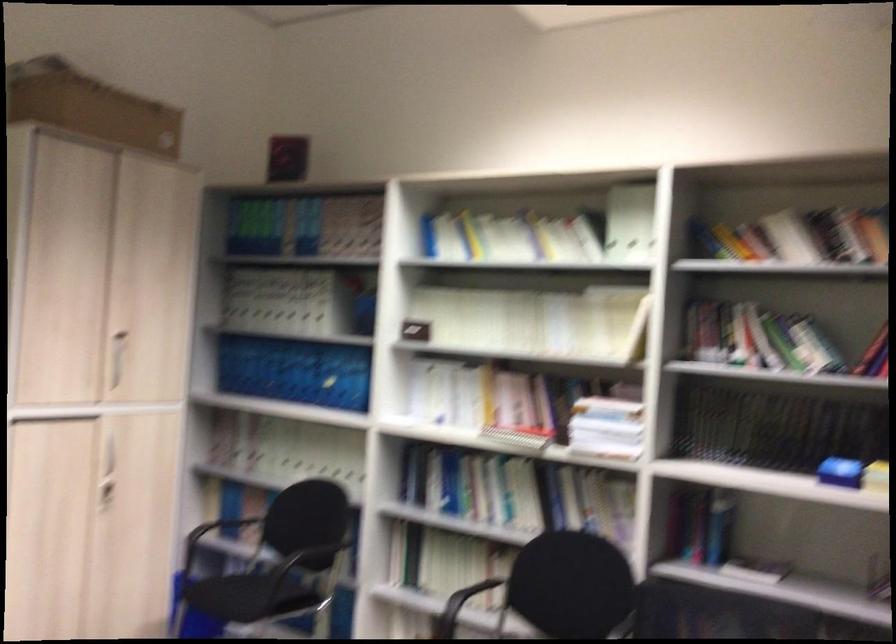
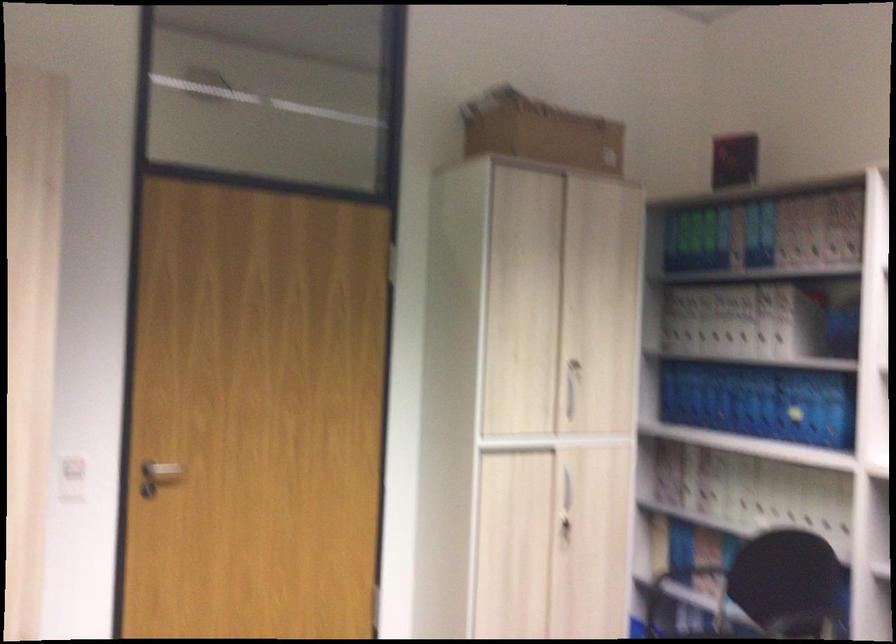
The images are taken continuously from a first-person perspective. In which direction are you moving?

The cameraman walked toward left, forward.